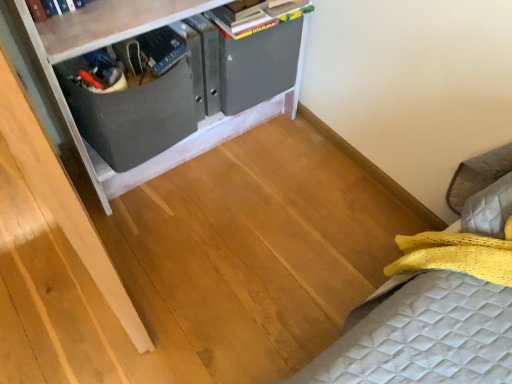
Find the location of `blank space above matte black drawer at center (from a real-world perspective)`. blank space above matte black drawer at center (from a real-world perspective) is located at coordinates (136, 77).